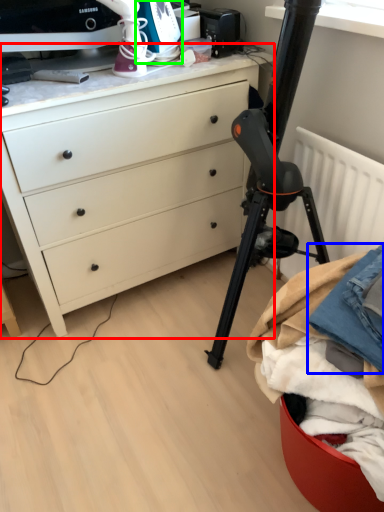
Question: Estimate the real-world distances between objects in this image. Which object is farther from chest of drawers (highlighted by a red box), clothing (highlighted by a blue box) or appliance (highlighted by a green box)?

Choices:
 (A) clothing
 (B) appliance

Answer: (A)